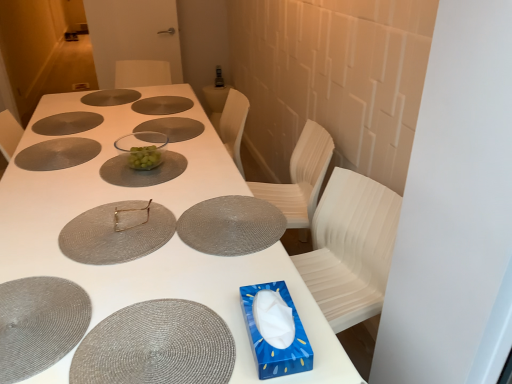
Identify the location of vacant space that is in between matte gray glass plate at upper left, which is counted as the 7th glass plate, starting from the front, and matte gray glass plate at center, the eighth glass plate viewed from the front. The height and width of the screenshot is (384, 512). (105, 108).